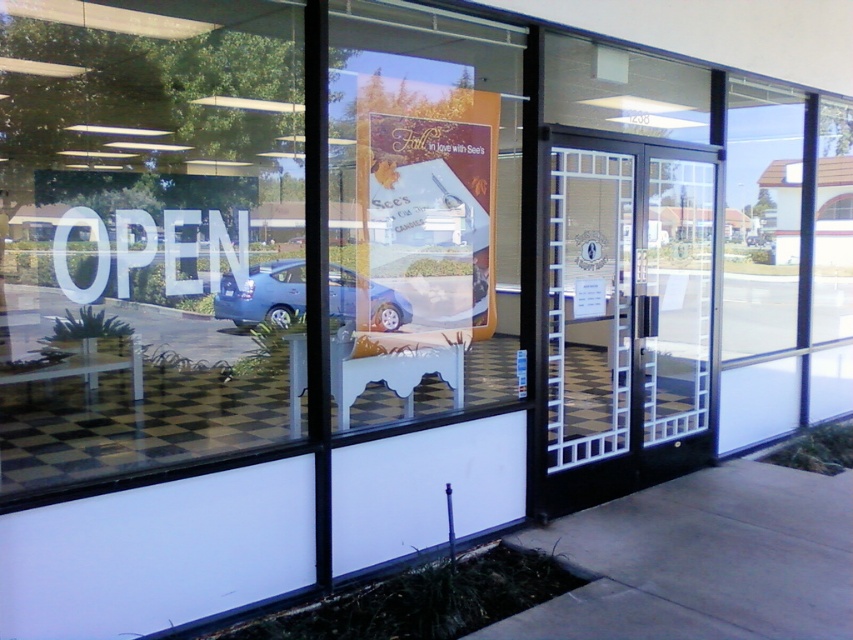
Question: Observing the image, what is the correct spatial positioning of matte orange poster at center in reference to black glass door at center?

Choices:
 (A) right
 (B) left

Answer: (B)

Question: In this image, where is matte orange poster at center located relative to black glass door at center?

Choices:
 (A) right
 (B) left

Answer: (B)

Question: Can you confirm if white plastic sign at left is wider than matte blue car at center?

Choices:
 (A) yes
 (B) no

Answer: (B)

Question: Which point is closer to the camera?

Choices:
 (A) matte orange poster at center
 (B) white plastic sign at left
 (C) black glass door at center
 (D) matte blue car at center

Answer: (D)

Question: Which point is closer to the camera?

Choices:
 (A) white plastic sign at left
 (B) black glass door at center
 (C) matte orange poster at center
 (D) matte blue car at center

Answer: (D)

Question: Which point appears farthest from the camera in this image?

Choices:
 (A) (276, 177)
 (B) (397, 301)
 (C) (563, 224)
 (D) (347, 371)

Answer: (A)